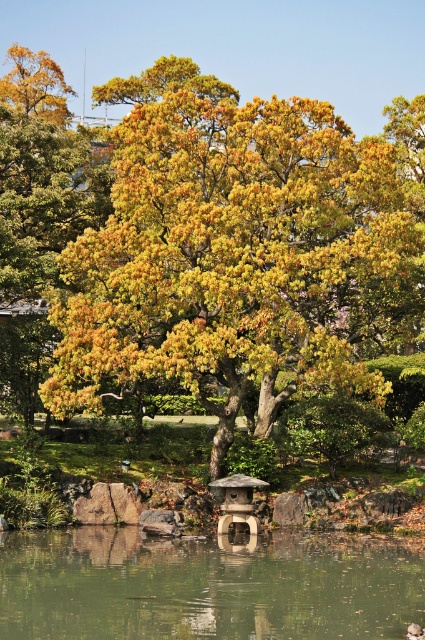
Is point (312, 365) closer to viewer compared to point (240, 506)?

No, it is not.

Between point (206, 368) and point (226, 532), which one is positioned in front?

Point (206, 368) is more forward.

What are the coordinates of `yellow-green foliage at center` in the screenshot? It's located at (238, 252).

Does yellow-green foliage at center have a greater width compared to transparent glass water at center?

Correct, the width of yellow-green foliage at center exceeds that of transparent glass water at center.

This screenshot has width=425, height=640. In order to click on yellow-green foliage at center in this screenshot , I will do `click(238, 252)`.

I want to click on yellow-green foliage at center, so click(238, 252).

Is transparent glass water at center closer to the viewer compared to beige stone gazebo at center?

Yes, it is.

Between transparent glass water at center and beige stone gazebo at center, which one appears on the left side from the viewer's perspective?

From the viewer's perspective, transparent glass water at center appears more on the left side.

Between point (164, 604) and point (217, 484), which one is positioned behind?

Positioned behind is point (217, 484).

Locate an element on the screen. transparent glass water at center is located at coordinates click(x=206, y=586).